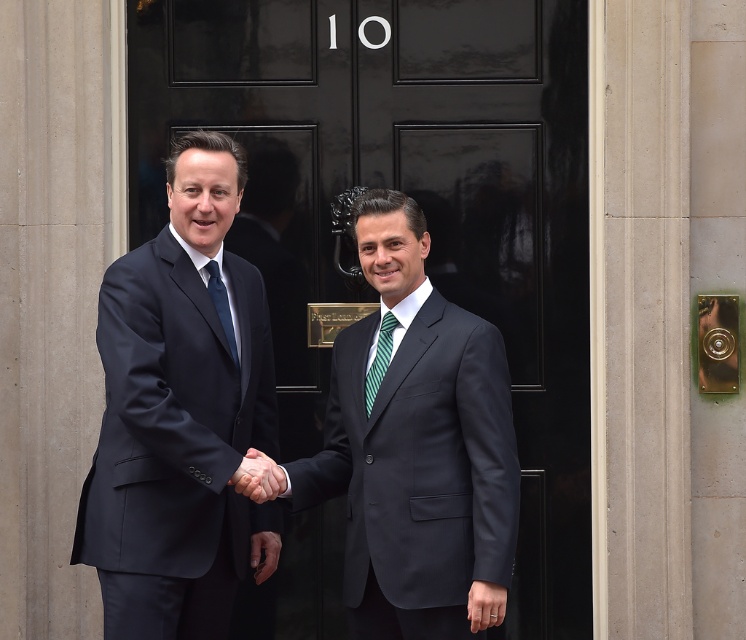
Question: From the image, what is the correct spatial relationship of matte black suit at center in relation to matte black tie at center?

Choices:
 (A) above
 (B) below

Answer: (B)

Question: From the image, what is the correct spatial relationship of smooth skin handshake at center in relation to green striped tie at center?

Choices:
 (A) above
 (B) below

Answer: (B)

Question: Which of the following is the closest to the observer?

Choices:
 (A) (377, 211)
 (B) (222, 289)
 (C) (292, 220)

Answer: (B)

Question: Which point is farther to the camera?

Choices:
 (A) (383, 333)
 (B) (413, 381)
 (C) (222, 292)
 (D) (192, 634)

Answer: (A)

Question: In this image, where is dark blue suit at center located relative to smooth skin handshake at center?

Choices:
 (A) above
 (B) below

Answer: (A)

Question: Which object is closer to the camera taking this photo?

Choices:
 (A) matte black suit at center
 (B) black glossy door at center
 (C) green striped tie at center
 (D) dark blue suit at center

Answer: (A)